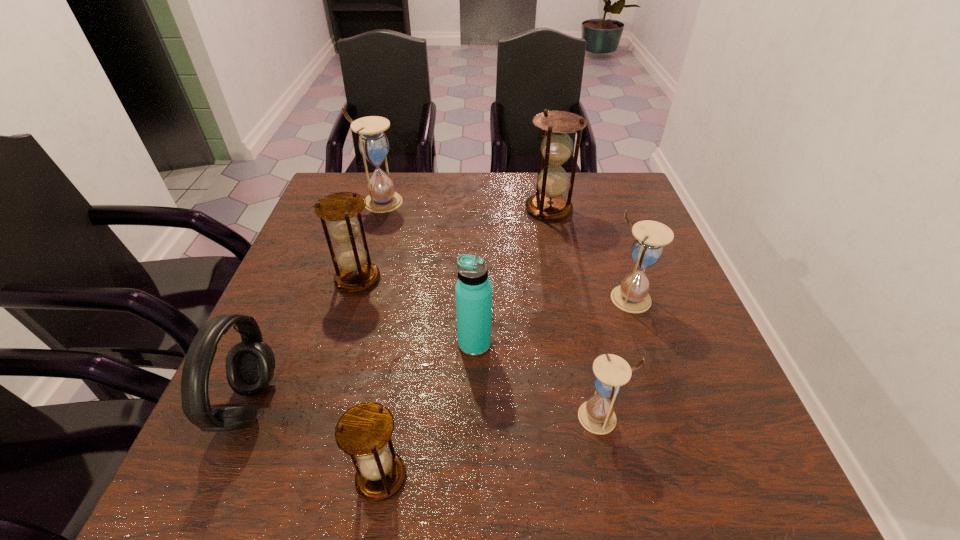
At what (x,y) coordinates should I click in order to perform the action: click on vacant space located on the back of the rightmost hourglass. Please return your answer as a coordinate pair (x, y). Looking at the image, I should click on (613, 252).

You are a GUI agent. You are given a task and a screenshot of the screen. Output one action in this format:
    pyautogui.click(x=<x>, y=<y>)
    Task: Click on the vacant area situated 0.260m on the earcups of the leftmost object
    The width and height of the screenshot is (960, 540).
    Given the screenshot: What is the action you would take?
    tap(414, 404)

Identify the location of vacant space located 0.240m on the left of the nearest white hourglass. (444, 417).

The image size is (960, 540). What are the coordinates of `vacant space situated on the back of the third hourglass from left to right` in the screenshot? It's located at (404, 333).

Find the location of a particular element. headset at the near edge is located at coordinates (250, 364).

I want to click on hourglass at the near edge, so click(363, 431).

The image size is (960, 540). In order to click on headset that is at the left edge in this screenshot , I will do `click(250, 364)`.

Find the location of a particular element. object that is at the right edge is located at coordinates (632, 296).

You are a GUI agent. You are given a task and a screenshot of the screen. Output one action in this format:
    pyautogui.click(x=<x>, y=<y>)
    Task: Click on the object situated at the far left corner
    
    Given the screenshot: What is the action you would take?
    pyautogui.click(x=373, y=144)

The width and height of the screenshot is (960, 540). Find the location of `object present at the near left corner`. object present at the near left corner is located at coordinates (250, 364).